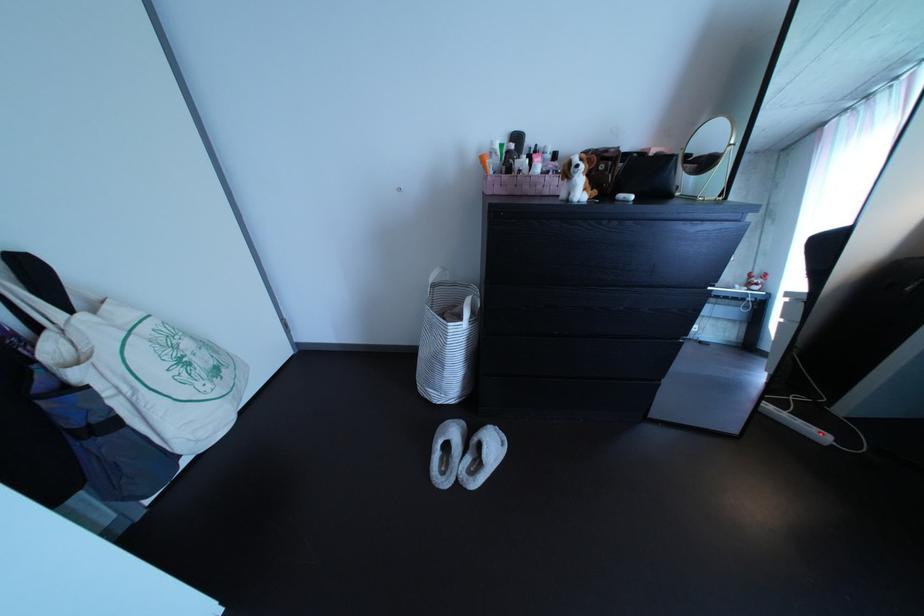
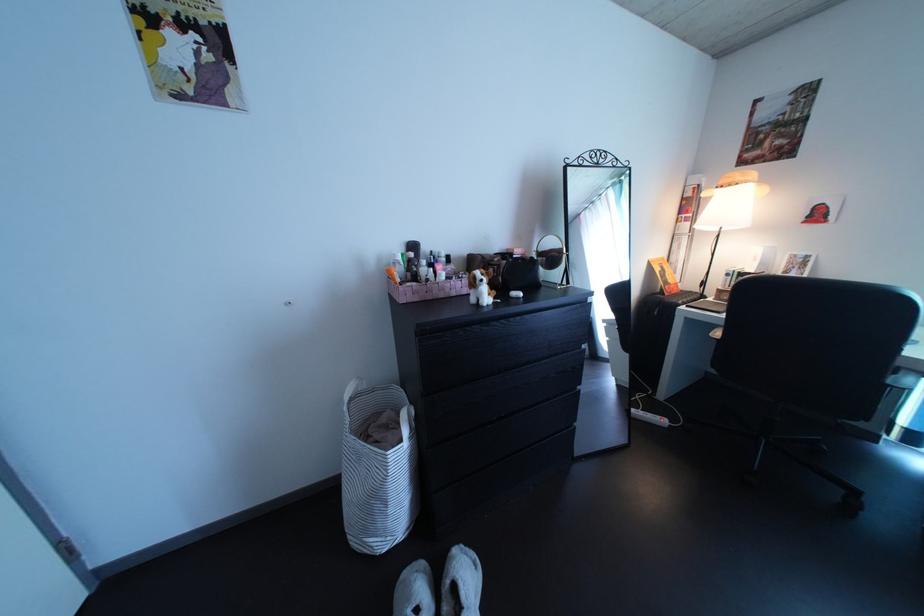
Question: I am providing you with two images of the same scene from different viewpoints. After the viewpoint changes to image2, which objects are now occluded?

Choices:
 (A) white cosmetic bottle
 (B) stuffed dog toy
 (C) small round mirror
 (D) none of these

Answer: (D)